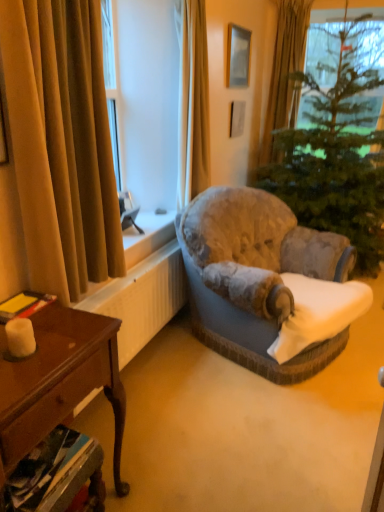
Question: From the image's perspective, is green textured christmas tree at center above matte silver picture frame at upper center?

Choices:
 (A) no
 (B) yes

Answer: (A)

Question: Is green textured christmas tree at center thinner than matte silver picture frame at upper center?

Choices:
 (A) no
 (B) yes

Answer: (A)

Question: Does green textured christmas tree at center come behind matte silver picture frame at upper center?

Choices:
 (A) no
 (B) yes

Answer: (A)

Question: From a real-world perspective, is green textured christmas tree at center positioned under matte silver picture frame at upper center based on gravity?

Choices:
 (A) no
 (B) yes

Answer: (B)

Question: Is green textured christmas tree at center in contact with matte silver picture frame at upper center?

Choices:
 (A) yes
 (B) no

Answer: (B)

Question: Considering the positions of white matte candle at lower left and white textured radiator at lower left in the image, is white matte candle at lower left bigger or smaller than white textured radiator at lower left?

Choices:
 (A) big
 (B) small

Answer: (B)

Question: Considering their positions, is white matte candle at lower left located in front of or behind white textured radiator at lower left?

Choices:
 (A) behind
 (B) front

Answer: (B)

Question: Considering the positions of white matte candle at lower left and white textured radiator at lower left in the image, is white matte candle at lower left taller or shorter than white textured radiator at lower left?

Choices:
 (A) short
 (B) tall

Answer: (A)

Question: Is white matte candle at lower left to the left or to the right of white textured radiator at lower left in the image?

Choices:
 (A) left
 (B) right

Answer: (A)

Question: In the image, is wooden desk at lower left on the left side or the right side of velvet gold curtain at left, placed as the 3th curtain when sorted from back to front?

Choices:
 (A) left
 (B) right

Answer: (A)

Question: Considering the positions of point (84, 349) and point (26, 141), is point (84, 349) closer or farther from the camera than point (26, 141)?

Choices:
 (A) closer
 (B) farther

Answer: (A)

Question: From their relative heights in the image, would you say wooden desk at lower left is taller or shorter than velvet gold curtain at left, which appears as the third curtain when viewed from the right?

Choices:
 (A) short
 (B) tall

Answer: (A)

Question: Considering their positions, is wooden desk at lower left located in front of or behind velvet gold curtain at left, placed as the 3th curtain when sorted from back to front?

Choices:
 (A) front
 (B) behind

Answer: (A)

Question: From their relative heights in the image, would you say velvet grey armchair at center is taller or shorter than matte silver picture frame at upper center?

Choices:
 (A) short
 (B) tall

Answer: (B)

Question: In the image, is velvet grey armchair at center on the left side or the right side of matte silver picture frame at upper center?

Choices:
 (A) right
 (B) left

Answer: (A)